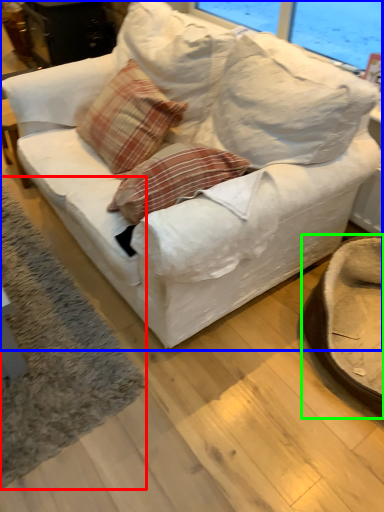
Question: Based on their relative distances, which object is farther from mat (highlighted by a red box)? Choose from studio couch (highlighted by a blue box) and swivel chair (highlighted by a green box).

Choices:
 (A) studio couch
 (B) swivel chair

Answer: (B)